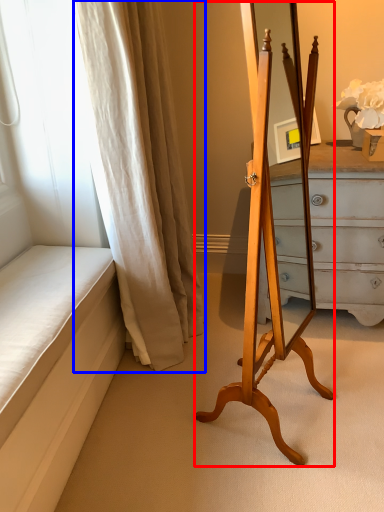
Question: Among these objects, which one is nearest to the camera, easel (highlighted by a red box) or curtain (highlighted by a blue box)?

Choices:
 (A) easel
 (B) curtain

Answer: (A)